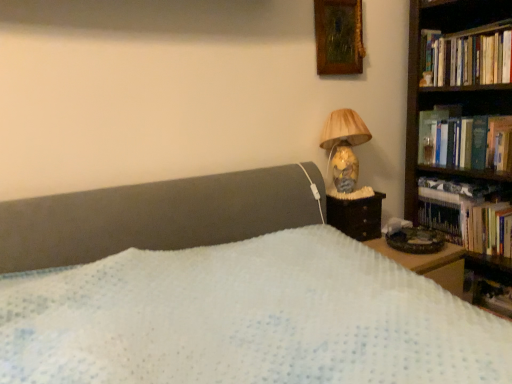
The width and height of the screenshot is (512, 384). In order to click on vacant space in matte yellow lampshade at upper right (from a real-world perspective) in this screenshot , I will do `click(350, 192)`.